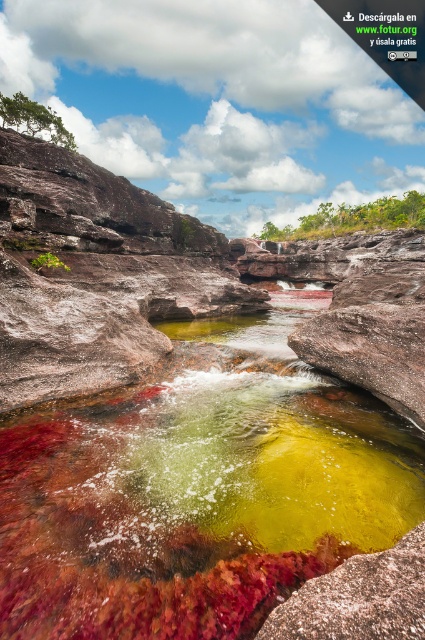
Does smooth rock at center have a smaller size compared to green algae at upper center?

Yes.

Locate an element on the screen. The image size is (425, 640). smooth rock at center is located at coordinates (359, 598).

Who is more forward, (320,584) or (285,227)?

Point (320,584)

This screenshot has width=425, height=640. In order to click on smooth rock at center in this screenshot , I will do `click(359, 598)`.

Between translucent rock pool at center and green algae at upper center, which one is positioned higher?

green algae at upper center

Is translucent rock pool at center further to the viewer compared to green algae at upper center?

No, it is in front of green algae at upper center.

Does point (141, 538) lie behind point (342, 216)?

No, it is not.

Locate an element on the screen. The height and width of the screenshot is (640, 425). translucent rock pool at center is located at coordinates (195, 499).

Does translucent rock pool at center have a smaller size compared to smooth rock at center?

No.

Looking at this image, is translucent rock pool at center to the left of smooth rock at center from the viewer's perspective?

Correct, you'll find translucent rock pool at center to the left of smooth rock at center.

Locate an element on the screen. The width and height of the screenshot is (425, 640). translucent rock pool at center is located at coordinates (195, 499).